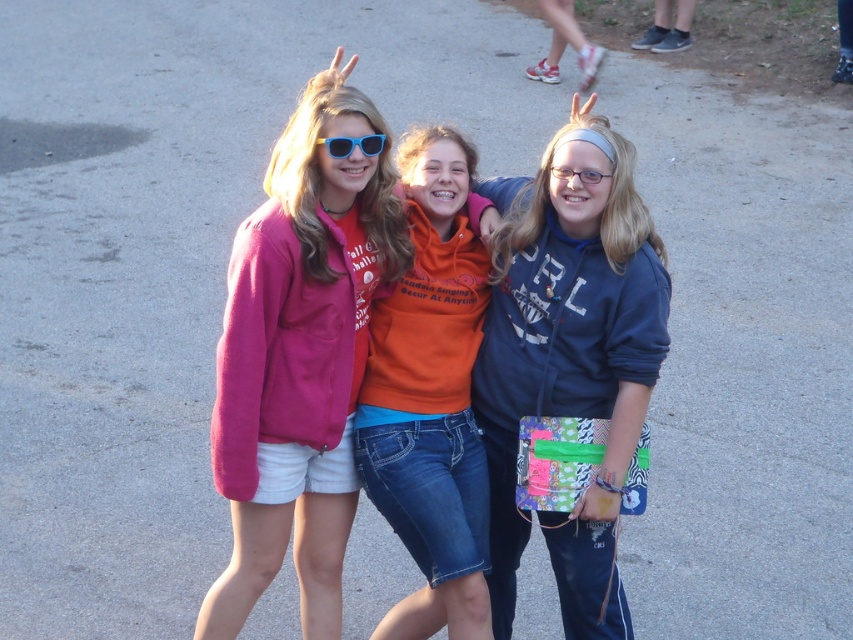
Does matte pink sweatshirt at center have a larger size compared to blue plastic sunglasses at center?

Correct, matte pink sweatshirt at center is larger in size than blue plastic sunglasses at center.

In order to click on matte pink sweatshirt at center in this screenshot , I will do `click(281, 349)`.

Looking at this image, which of these two, matte blue hoodie at center or blue plastic sunglasses at center, stands shorter?

With less height is blue plastic sunglasses at center.

Between matte blue hoodie at center and blue plastic sunglasses at center, which one is positioned higher?

blue plastic sunglasses at center is higher up.

Who is more forward, [589,314] or [370,136]?

Point [370,136]

This screenshot has height=640, width=853. I want to click on matte blue hoodie at center, so click(x=570, y=360).

Which is in front, point (575, 113) or point (347, 401)?

Point (347, 401)

Find the location of a particular element. This screenshot has width=853, height=640. matte blue hoodie at center is located at coordinates (570, 360).